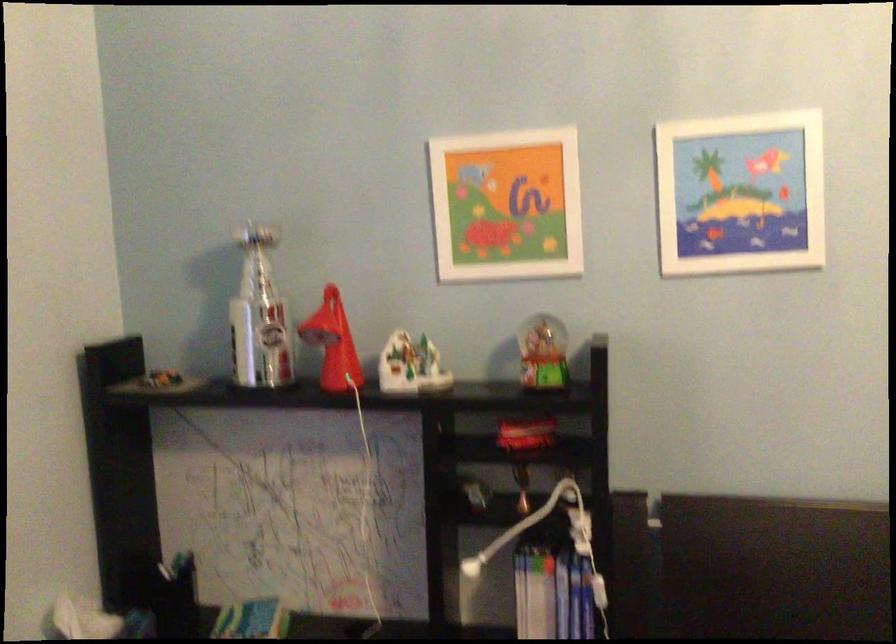
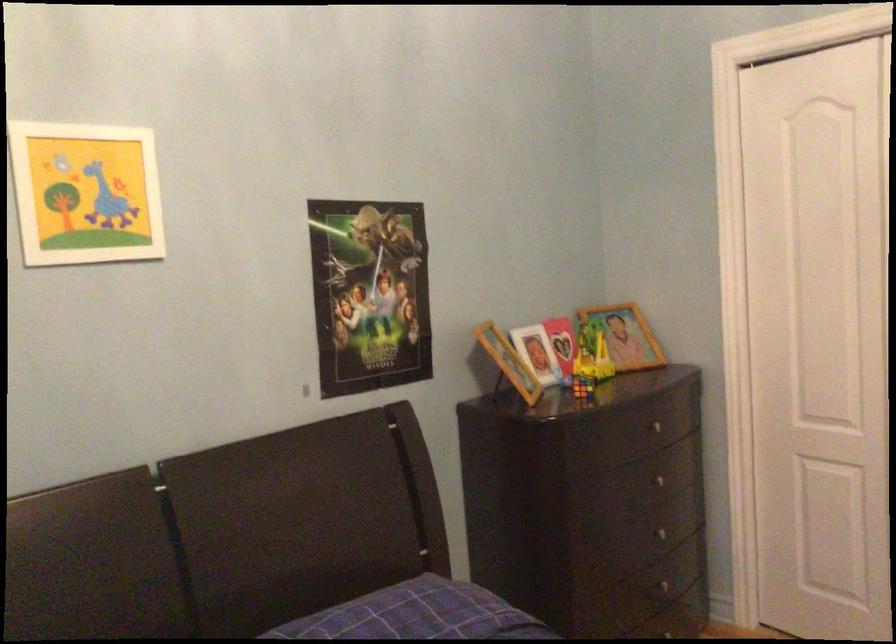
Question: Based on the continuous images, in which direction is the camera rotating? Reply with the corresponding letter.

Choices:
 (A) Left
 (B) Right
 (C) Up
 (D) Down

Answer: (B)